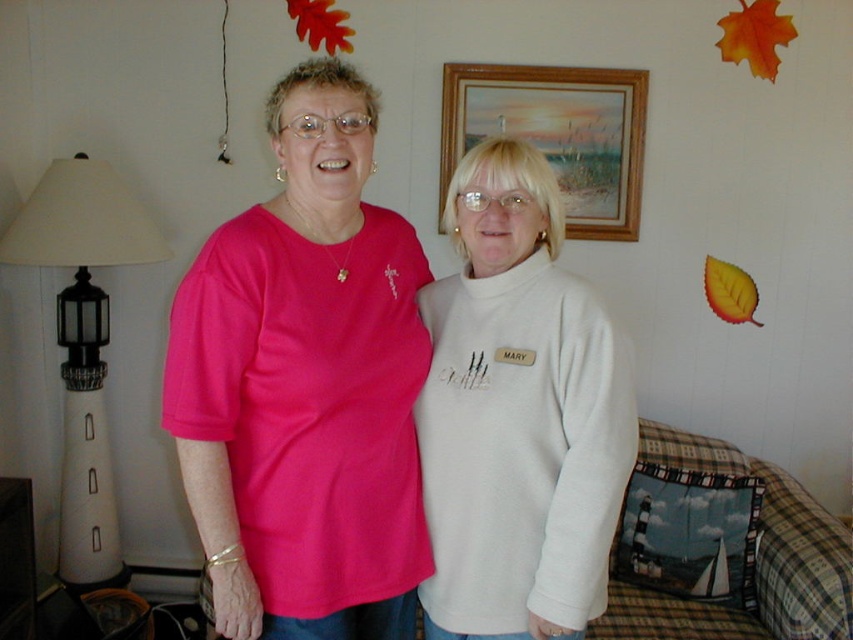
Question: Is white fleece sweater at center positioned before white matte lighthouse at left?

Choices:
 (A) no
 (B) yes

Answer: (B)

Question: Which of the following is the closest to the observer?

Choices:
 (A) white fleece sweater at center
 (B) wooden frame at upper center
 (C) white matte lighthouse at left
 (D) matte pink shirt at center

Answer: (D)

Question: Is white fleece sweater at center to the right of white matte lighthouse at left from the viewer's perspective?

Choices:
 (A) no
 (B) yes

Answer: (B)

Question: Which is nearer to the wooden frame at upper center?

Choices:
 (A) matte pink shirt at center
 (B) white fleece sweater at center
 (C) white matte lighthouse at left

Answer: (B)

Question: Can you confirm if matte pink shirt at center is wider than white matte lighthouse at left?

Choices:
 (A) yes
 (B) no

Answer: (A)

Question: Which point is closer to the camera taking this photo?

Choices:
 (A) (596, 230)
 (B) (193, 400)
 (C) (582, 301)

Answer: (B)